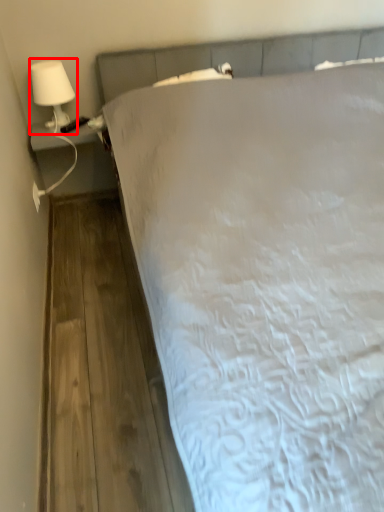
Question: In this image, where is lamp (annotated by the red box) located relative to bed?

Choices:
 (A) left
 (B) right

Answer: (A)